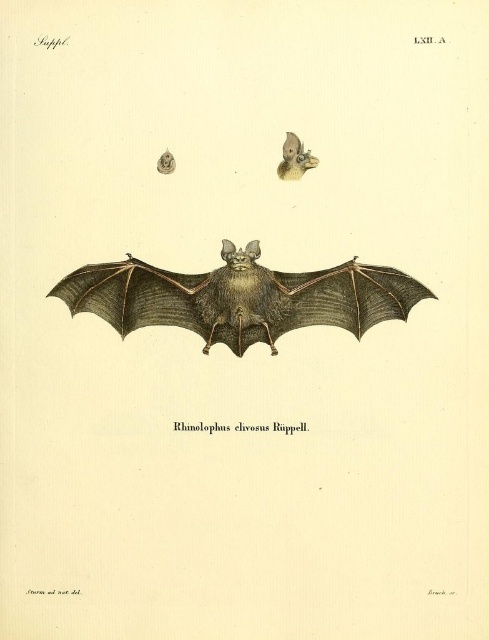
Can you confirm if brown textured bat at center is positioned above smooth beige bat head at upper center?

Actually, brown textured bat at center is below smooth beige bat head at upper center.

Where is `brown textured bat at center`? brown textured bat at center is located at coordinates (240, 298).

Find the location of a particular element. The width and height of the screenshot is (489, 640). brown textured bat at center is located at coordinates (240, 298).